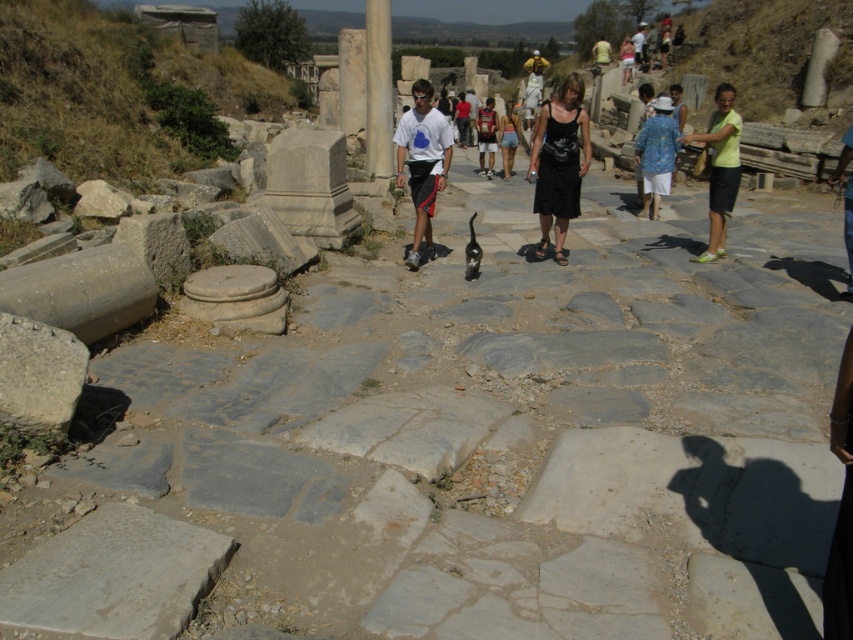
Question: Which object is farther from the camera taking this photo?

Choices:
 (A) matte black dress at center
 (B) white marble pillar at center

Answer: (A)

Question: Which object is the closest to the white marble pillar at center?

Choices:
 (A) white cotton t-shirt at center
 (B) light green fabric shirt at right
 (C) matte black dress at center
 (D) reddish-brown backpack at center

Answer: (D)

Question: Is white t-shirt at center positioned in front of white cotton t-shirt at center?

Choices:
 (A) no
 (B) yes

Answer: (B)

Question: Can you confirm if black cotton dress at center is positioned below white t-shirt at center?

Choices:
 (A) yes
 (B) no

Answer: (A)

Question: Is white marble pillar at center closer to camera compared to white cotton t-shirt at center?

Choices:
 (A) no
 (B) yes

Answer: (B)

Question: Estimate the real-world distances between objects in this image. Which object is farther from the white t-shirt at center?

Choices:
 (A) light green fabric shirt at right
 (B) matte black dress at center
 (C) white marble pillar at center

Answer: (B)